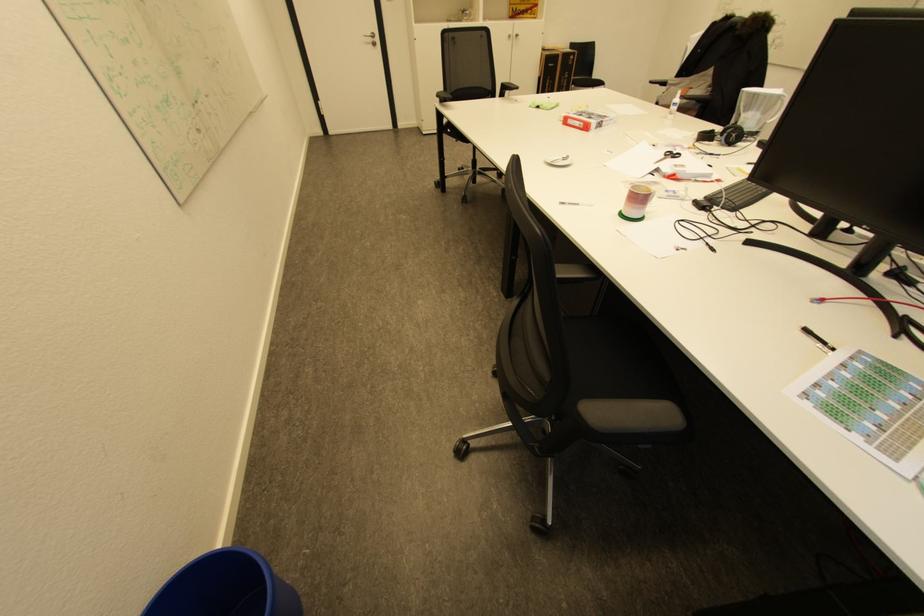
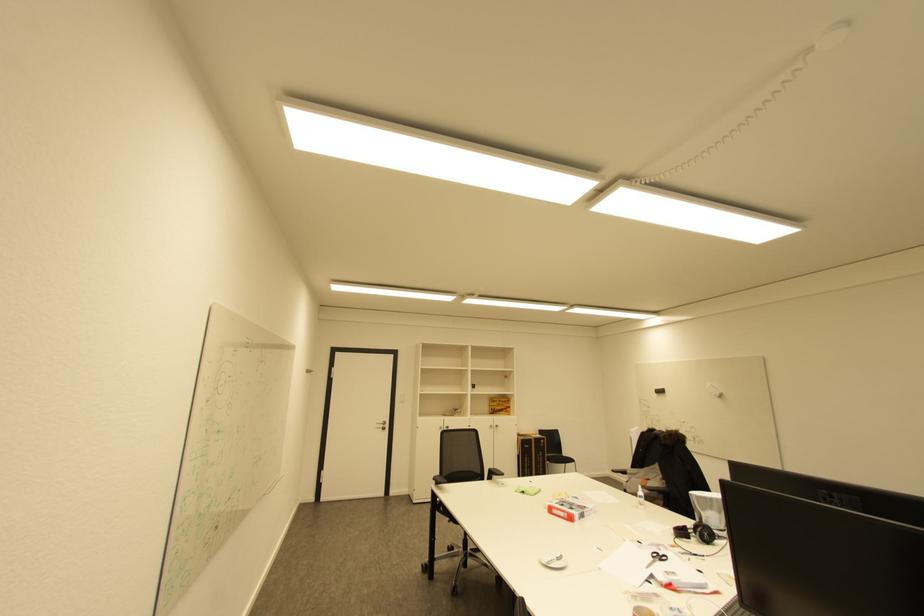
In the second image, find the point that corresponds to point (732, 136) in the first image.

(704, 533)